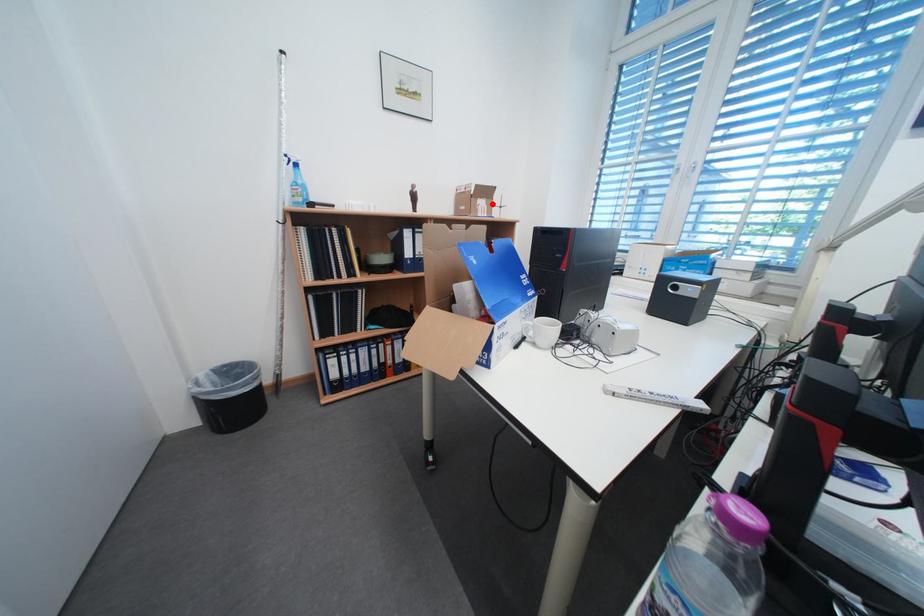
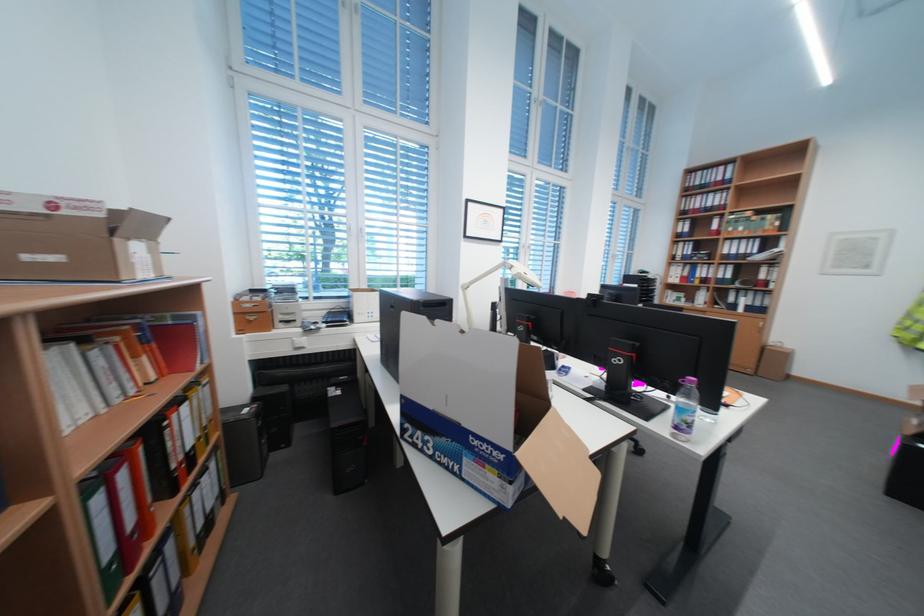
Where in the second image is the point corresponding to the highlighted location from the first image?

(148, 249)